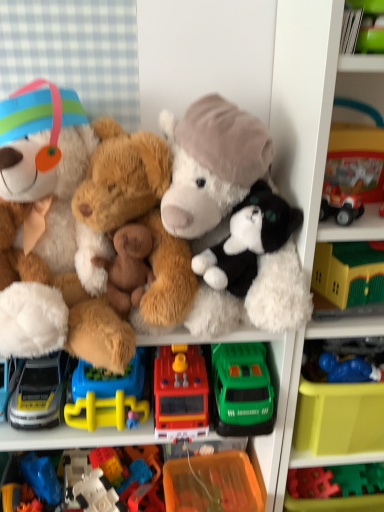
Question: Which direction should I rotate to look at rubber fire truck at center, the fourth toy viewed from the left?

Choices:
 (A) left
 (B) right

Answer: (A)

Question: Which direction should I rotate to look at brown plush bear at center, marked as the third toy in a left-to-right arrangement?

Choices:
 (A) right
 (B) left

Answer: (B)

Question: Is orange plastic container at lower center at the right side of rubber fire truck at center, which ranks as the third toy in right-to-left order?

Choices:
 (A) no
 (B) yes

Answer: (B)

Question: From the image's perspective, is orange plastic container at lower center under rubber fire truck at center, which ranks as the third toy in right-to-left order?

Choices:
 (A) no
 (B) yes

Answer: (B)

Question: Considering the relative sizes of orange plastic container at lower center and rubber fire truck at center, the fourth toy viewed from the left, in the image provided, is orange plastic container at lower center wider than rubber fire truck at center, the fourth toy viewed from the left,?

Choices:
 (A) no
 (B) yes

Answer: (A)

Question: Does orange plastic container at lower center turn towards rubber fire truck at center, the fourth toy viewed from the left?

Choices:
 (A) yes
 (B) no

Answer: (B)

Question: Can we say orange plastic container at lower center lies outside rubber fire truck at center, the fourth toy viewed from the left?

Choices:
 (A) yes
 (B) no

Answer: (A)

Question: Would you say rubber fire truck at center, the fourth toy viewed from the left, is part of orange plastic container at lower center's contents?

Choices:
 (A) no
 (B) yes

Answer: (A)

Question: From a real-world perspective, is orange plastic container at lower center over blue rubber toy at lower right, marked as the 6th toy in a left-to-right arrangement?

Choices:
 (A) yes
 (B) no

Answer: (B)

Question: Is orange plastic container at lower center not inside blue rubber toy at lower right, which is counted as the first toy, starting from the right?

Choices:
 (A) yes
 (B) no

Answer: (A)

Question: Can you confirm if orange plastic container at lower center is bigger than blue rubber toy at lower right, marked as the 6th toy in a left-to-right arrangement?

Choices:
 (A) no
 (B) yes

Answer: (B)

Question: From a real-world perspective, is orange plastic container at lower center located beneath blue rubber toy at lower right, marked as the 6th toy in a left-to-right arrangement?

Choices:
 (A) yes
 (B) no

Answer: (A)

Question: Could blue rubber toy at lower right, which is counted as the first toy, starting from the right, be considered to be inside orange plastic container at lower center?

Choices:
 (A) no
 (B) yes

Answer: (A)

Question: Does orange plastic container at lower center turn towards blue rubber toy at lower right, which is counted as the first toy, starting from the right?

Choices:
 (A) yes
 (B) no

Answer: (B)

Question: Is there a large distance between brown plush bear at center, marked as the 4th toy in a right-to-left arrangement, and rubber fire truck at center, the fourth toy viewed from the left?

Choices:
 (A) no
 (B) yes

Answer: (A)